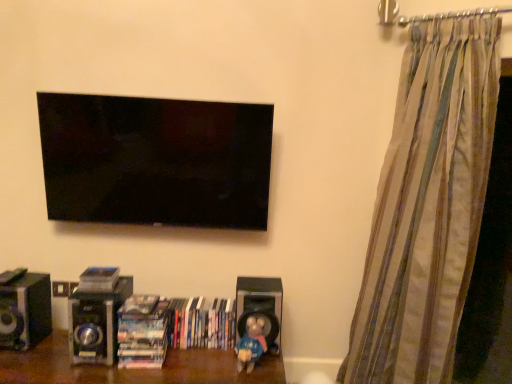
Image resolution: width=512 pixels, height=384 pixels. Describe the element at coordinates (200, 323) in the screenshot. I see `hardcover books at center, which is the first book from right to left` at that location.

How much space does black matte speaker at lower center, the 3th speaker when ordered from left to right, occupy horizontally?

black matte speaker at lower center, the 3th speaker when ordered from left to right, is 9.65 inches in width.

Image resolution: width=512 pixels, height=384 pixels. What do you see at coordinates (132, 369) in the screenshot?
I see `wooden shelf at lower center` at bounding box center [132, 369].

Locate an element on the screen. The image size is (512, 384). hardcover books at center, which is the first book from right to left is located at coordinates (200, 323).

Could you measure the distance between black glossy speaker at lower left, which ranks as the 1th speaker in left-to-right order, and hardcover books at center, the 3th book positioned from the left?

black glossy speaker at lower left, which ranks as the 1th speaker in left-to-right order, and hardcover books at center, the 3th book positioned from the left, are 27.40 inches apart.

Could you tell me if black glossy speaker at lower left, the third speaker viewed from the right, is turned towards hardcover books at center, which is the first book from right to left?

No, black glossy speaker at lower left, the third speaker viewed from the right, is not aimed at hardcover books at center, which is the first book from right to left.

Which is behind, point (23, 309) or point (218, 317)?

The point (218, 317) is farther from the camera.

Visually, is black matte speaker at lower center, the 3th speaker when ordered from left to right, positioned to the left or to the right of metallic silver speaker at lower left, which ranks as the second speaker in right-to-left order?

black matte speaker at lower center, the 3th speaker when ordered from left to right, is to the right of metallic silver speaker at lower left, which ranks as the second speaker in right-to-left order.

At what (x,y) coordinates should I click in order to perform the action: click on speaker on the right of metallic silver speaker at lower left, which ranks as the second speaker in right-to-left order. Please return your answer as a coordinate pair (x, y). This screenshot has width=512, height=384. Looking at the image, I should click on (260, 307).

Considering the sizes of objects black matte speaker at lower center, the 3th speaker when ordered from left to right, and metallic silver speaker at lower left, the 2th speaker in the left-to-right sequence, in the image provided, who is thinner, black matte speaker at lower center, the 3th speaker when ordered from left to right, or metallic silver speaker at lower left, the 2th speaker in the left-to-right sequence,?

Thinner between the two is black matte speaker at lower center, the 3th speaker when ordered from left to right.

Does black matte speaker at lower center, which is the 1th speaker in right-to-left order, have a larger size compared to metallic silver speaker at lower left, which ranks as the second speaker in right-to-left order?

No.

Is black glossy speaker at lower left, which ranks as the 1th speaker in left-to-right order, next to wooden shelf at lower center?

black glossy speaker at lower left, which ranks as the 1th speaker in left-to-right order, is not next to wooden shelf at lower center, and they're not touching.

Is black glossy speaker at lower left, which ranks as the 1th speaker in left-to-right order, situated inside wooden shelf at lower center or outside?

black glossy speaker at lower left, which ranks as the 1th speaker in left-to-right order, is outside wooden shelf at lower center.

Between striped fabric curtain at right and hardcover books at center, which is the first book from right to left, which one appears on the right side from the viewer's perspective?

From the viewer's perspective, striped fabric curtain at right appears more on the right side.

Is striped fabric curtain at right not within hardcover books at center, the 3th book positioned from the left?

Indeed, striped fabric curtain at right is completely outside hardcover books at center, the 3th book positioned from the left.

What's the angular difference between striped fabric curtain at right and wooden shelf at lower center's facing directions?

The facing directions of striped fabric curtain at right and wooden shelf at lower center are 45.8 degrees apart.

Is striped fabric curtain at right not within wooden shelf at lower center?

striped fabric curtain at right lies outside wooden shelf at lower center's area.

Who is taller, striped fabric curtain at right or wooden shelf at lower center?

With more height is striped fabric curtain at right.

Where is `furniture that is below the striped fabric curtain at right (from the image's perspective)`? furniture that is below the striped fabric curtain at right (from the image's perspective) is located at coordinates (132, 369).

Does blue matte toy at lower center have a greater height compared to wooden shelf at lower center?

In fact, blue matte toy at lower center may be shorter than wooden shelf at lower center.

Which is more to the left, blue matte toy at lower center or wooden shelf at lower center?

wooden shelf at lower center is more to the left.

Which object is thinner, blue matte toy at lower center or wooden shelf at lower center?

Thinner between the two is blue matte toy at lower center.

From a real-world perspective, is blue matte toy at lower center positioned above or below wooden shelf at lower center?

blue matte toy at lower center is situated higher than wooden shelf at lower center in the real world.

From the image's perspective, which one is positioned higher, hardcover books at center, the 3th book positioned from the left, or wooden shelf at lower center?

hardcover books at center, the 3th book positioned from the left, is shown above in the image.

Is hardcover books at center, which is the first book from right to left, positioned with its back to wooden shelf at lower center?

hardcover books at center, which is the first book from right to left, does not have its back to wooden shelf at lower center.

From a real-world perspective, who is located higher, hardcover books at center, which is the first book from right to left, or wooden shelf at lower center?

hardcover books at center, which is the first book from right to left.

From a real-world perspective, count 1st books upward from the wooden shelf at lower center and point to it. Please provide its 2D coordinates.

[(200, 323)]

At what (x,y) coordinates should I click in order to perform the action: click on the 2nd speaker to the left of the hardcover books at center, which is the first book from right to left, counting from the anchor's position. Please return your answer as a coordinate pair (x, y). The image size is (512, 384). Looking at the image, I should click on (25, 311).

From a real-world perspective, starting from the metallic silver speaker at lower left, which ranks as the second speaker in right-to-left order, which speaker is the 2nd one vertically above it? Please provide its 2D coordinates.

[(260, 307)]

From the image, which object appears to be farther from black glossy speaker at lower left, the third speaker viewed from the right, hardcover books at center, acting as the 2th book starting from the left, or black matte speaker at lower center, which is the 1th speaker in right-to-left order?

black matte speaker at lower center, which is the 1th speaker in right-to-left order, is further to black glossy speaker at lower left, the third speaker viewed from the right.

From the image, which object appears to be farther from black matte speaker at lower center, the 3th speaker when ordered from left to right, wooden shelf at lower center or blue matte toy at lower center?

wooden shelf at lower center.

Based on the photo, based on their spatial positions, is striped fabric curtain at right or blue matte toy at lower center closer to hardcover books at center, which is the first book from right to left?

The object closer to hardcover books at center, which is the first book from right to left, is blue matte toy at lower center.

Estimate the real-world distances between objects in this image. Which object is closer to wooden shelf at lower center, black glossy speaker at lower left, the third speaker viewed from the right, or hardcover books at center, the 3th book positioned from the left?

Among the two, hardcover books at center, the 3th book positioned from the left, is located nearer to wooden shelf at lower center.

Which object lies further to the anchor point striped fabric curtain at right, black glossy speaker at lower left, which ranks as the 1th speaker in left-to-right order, or hardcover books at center, the 2th book when ordered from right to left?

black glossy speaker at lower left, which ranks as the 1th speaker in left-to-right order, lies further to striped fabric curtain at right than the other object.

Looking at the image, which one is located closer to black matte speaker at lower center, which is the 1th speaker in right-to-left order, wooden shelf at lower center or matte plastic book at lower center, which is the 1th book in left-to-right order?

Among the two, wooden shelf at lower center is located nearer to black matte speaker at lower center, which is the 1th speaker in right-to-left order.

From the image, which object appears to be nearer to blue matte toy at lower center, black glossy speaker at lower left, the third speaker viewed from the right, or hardcover books at center, which is the first book from right to left?

hardcover books at center, which is the first book from right to left, is positioned closer to the anchor blue matte toy at lower center.

Based on their spatial positions, is black glossy speaker at lower left, which ranks as the 1th speaker in left-to-right order, or black matte speaker at lower center, the 3th speaker when ordered from left to right, closer to striped fabric curtain at right?

black matte speaker at lower center, the 3th speaker when ordered from left to right, is positioned closer to the anchor striped fabric curtain at right.

At what (x,y) coordinates should I click in order to perform the action: click on speaker between metallic silver speaker at lower left, which ranks as the second speaker in right-to-left order, and striped fabric curtain at right, in the horizontal direction. Please return your answer as a coordinate pair (x, y). The width and height of the screenshot is (512, 384). Looking at the image, I should click on (260, 307).

I want to click on book situated between hardcover books at center, acting as the 2th book starting from the left, and blue matte toy at lower center from left to right, so click(200, 323).

Find the location of a particular element. The image size is (512, 384). furniture between black glossy speaker at lower left, the third speaker viewed from the right, and blue matte toy at lower center from left to right is located at coordinates (132, 369).

Locate an element on the screen. This screenshot has width=512, height=384. toy between hardcover books at center, the 2th book when ordered from right to left, and black matte speaker at lower center, which is the 1th speaker in right-to-left order, from left to right is located at coordinates (251, 345).